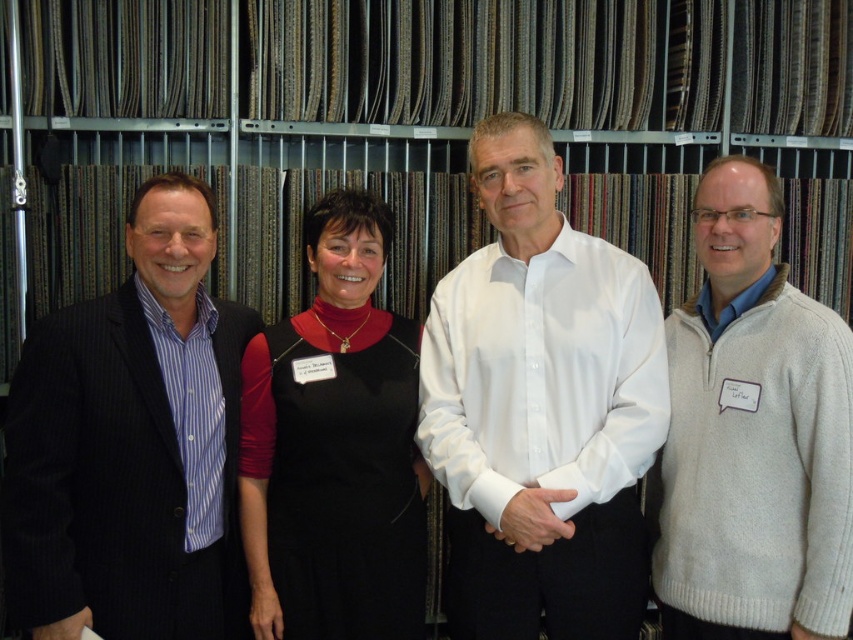
You are a photographer setting up a shoot in a showroom. You need to ensure that all clothing items in the scene are visible. Given that the white smooth shirt at center and the striped cotton shirt at left are part of the setup, which one might require adjustment to ensure it doesn not block the other?

The striped cotton shirt at left occupies more space than the white smooth shirt at center, so it might need to be moved closer to prevent blocking the smaller shirt.

You are standing in front of the group of people in the showroom. You need to hand a catalog to the person wearing the white knit sweater at right and the person wearing the black dress at center. Which one should you approach first based on their positions?

The white knit sweater at right is closer to the viewer than the black dress at center, so you should approach the person wearing the white knit sweater at right first.

You are a photographer adjusting your camera settings to capture the scene. You notice two points of interest in the image, labeled as point (531, 131) and point (119, 458). Which point should you focus on first if you want to ensure the closest object is in sharp focus?

Point (531, 131) should be focused on first because it is closer to the camera than point (119, 458), ensuring the closest object is in sharp focus.